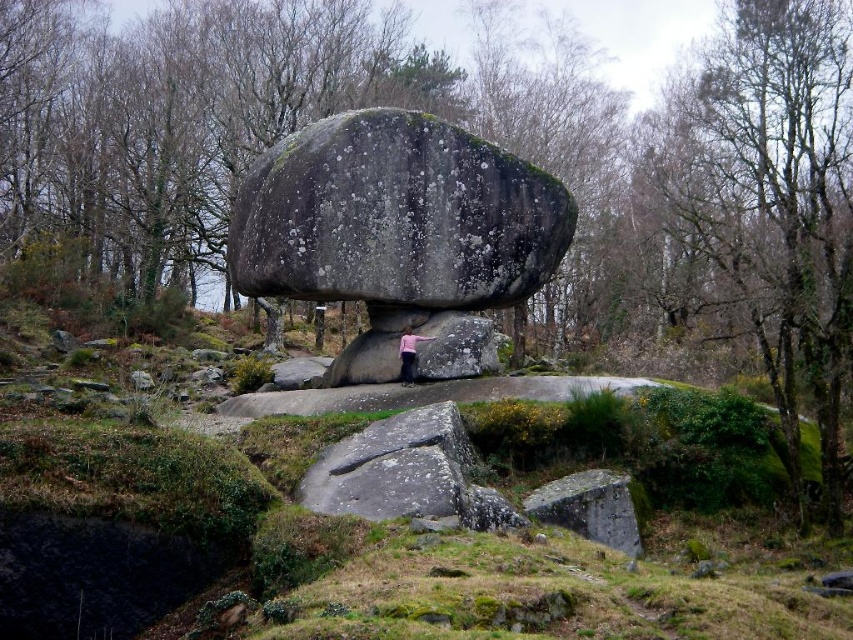
Can you confirm if gray rough rock at center is positioned above pink fabric at center?

Yes, gray rough rock at center is above pink fabric at center.

Who is taller, gray rough rock at center or pink fabric at center?

Standing taller between the two is gray rough rock at center.

Is point (254, 276) farther from viewer compared to point (410, 356)?

That is True.

You are a GUI agent. You are given a task and a screenshot of the screen. Output one action in this format:
    pyautogui.click(x=<x>, y=<y>)
    Task: Click on the gray rough rock at center
    The height and width of the screenshot is (640, 853).
    Given the screenshot: What is the action you would take?
    pyautogui.click(x=399, y=234)

Can you confirm if green mossy rock at center is positioned to the left of pink fabric at center?

Indeed, green mossy rock at center is positioned on the left side of pink fabric at center.

Is green mossy rock at center smaller than pink fabric at center?

No.

Is point (357, 566) positioned before point (413, 353)?

Yes, point (357, 566) is closer to viewer.

I want to click on green mossy rock at center, so click(x=363, y=525).

Can you confirm if green mossy rock at center is thinner than gray rough rock at center?

Incorrect, green mossy rock at center's width is not less than gray rough rock at center's.

Does green mossy rock at center have a smaller size compared to gray rough rock at center?

No, green mossy rock at center is not smaller than gray rough rock at center.

Does point (503, 522) come closer to viewer compared to point (386, 356)?

Yes, it is.

What are the coordinates of `green mossy rock at center` in the screenshot? It's located at (363, 525).